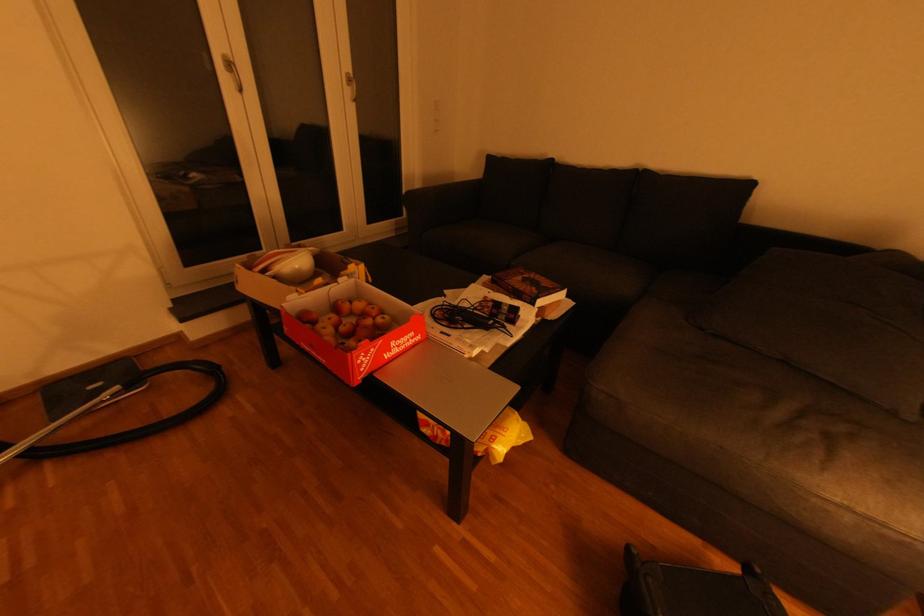
Describe the element at coordinates (828, 325) in the screenshot. The image size is (924, 616). I see `the sofa sitting surface` at that location.